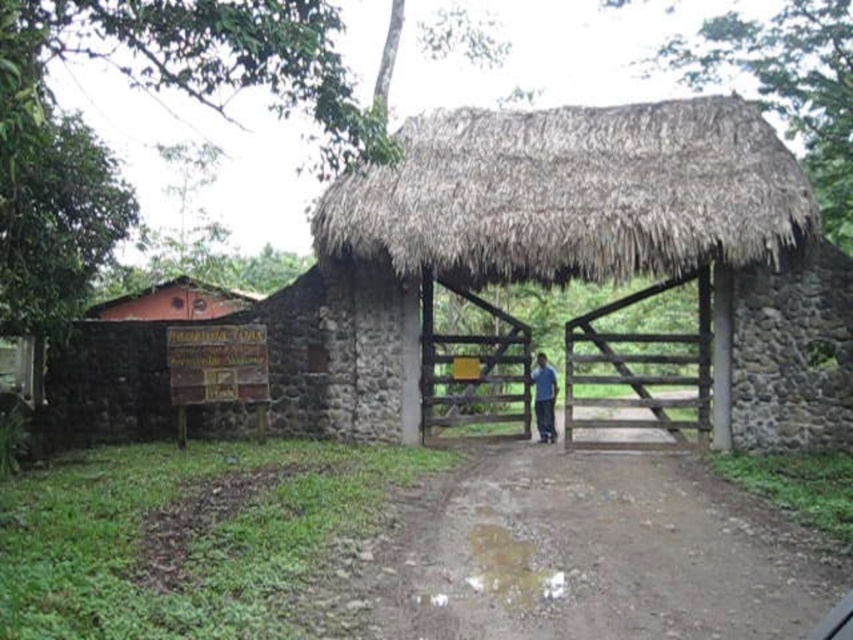
Question: Which object is positioned farthest from the thatched straw hut at center?

Choices:
 (A) brown dirt track at center
 (B) blue fabric shirt at center

Answer: (A)

Question: Which point appears farthest from the camera in this image?

Choices:
 (A) (189, 289)
 (B) (550, 420)
 (C) (468, 572)
 (D) (573, 208)

Answer: (A)

Question: Considering the real-world distances, which object is farthest from the blue fabric shirt at center?

Choices:
 (A) brown dirt track at center
 (B) brown thatch hut at upper left
 (C) thatched straw hut at center

Answer: (B)

Question: Does thatched straw hut at center come behind brown thatch hut at upper left?

Choices:
 (A) no
 (B) yes

Answer: (A)

Question: Is brown dirt track at center thinner than brown thatch hut at upper left?

Choices:
 (A) no
 (B) yes

Answer: (A)

Question: Is thatched straw hut at center behind blue fabric shirt at center?

Choices:
 (A) yes
 (B) no

Answer: (B)